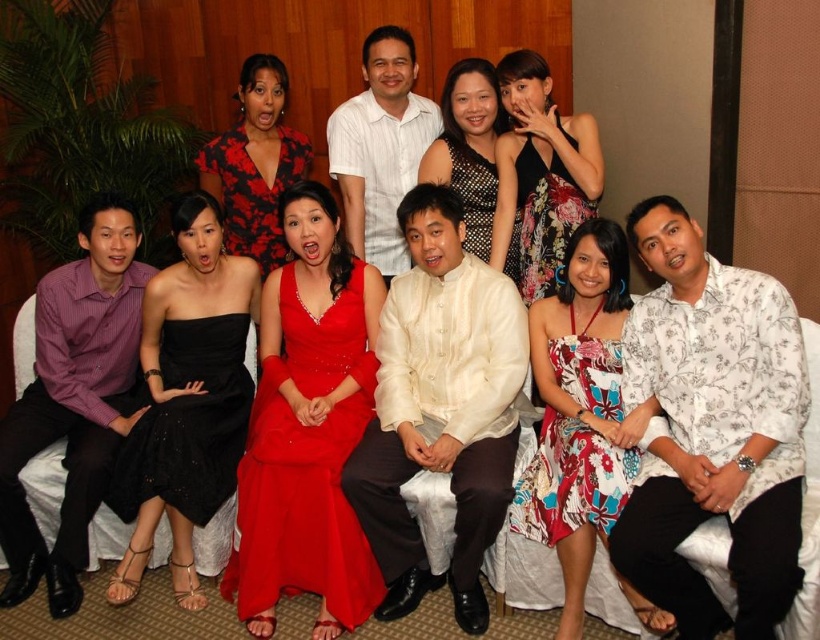
Question: Is white cotton shirt at upper center positioned behind matte black dress at center?

Choices:
 (A) yes
 (B) no

Answer: (A)

Question: Which point is closer to the camera?

Choices:
 (A) shiny satin dress at center
 (B) red floral dress at center
 (C) purple striped shirt at left

Answer: (A)

Question: Is white floral shirt at right smaller than floral print dress at center?

Choices:
 (A) yes
 (B) no

Answer: (B)

Question: Can you confirm if white cotton shirt at upper center is positioned below floral print dress at lower right?

Choices:
 (A) yes
 (B) no

Answer: (B)

Question: Which of the following is the farthest from the observer?

Choices:
 (A) white floral shirt at right
 (B) black satin dress at left

Answer: (B)

Question: Among these objects, which one is nearest to the camera?

Choices:
 (A) white floral shirt at right
 (B) matte black dress at center

Answer: (A)